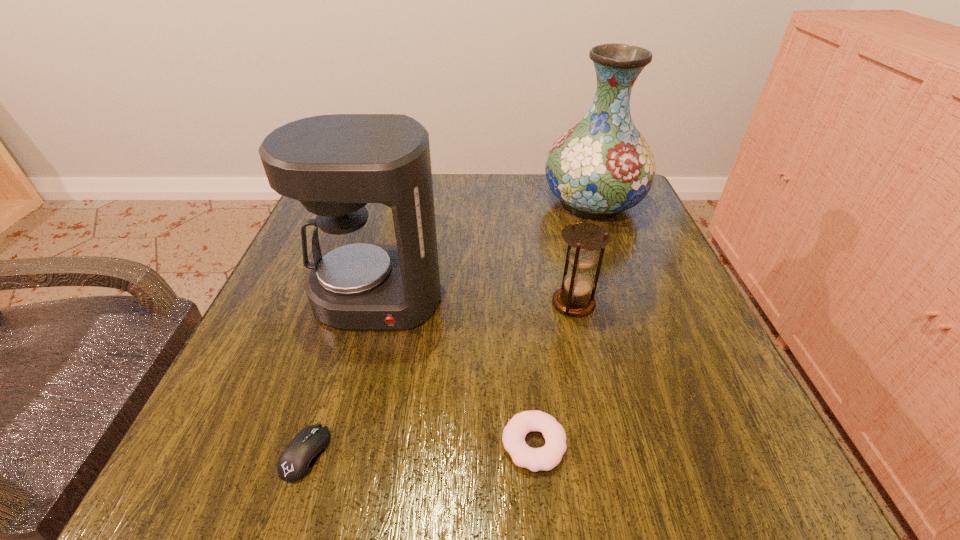
At what (x,y) coordinates should I click in order to perform the action: click on vacant area at the left edge. Please return your answer as a coordinate pair (x, y). Looking at the image, I should click on (262, 370).

Find the location of a particular element. Image resolution: width=960 pixels, height=540 pixels. free space at the right edge of the desktop is located at coordinates (616, 334).

I want to click on free space at the far left corner of the desktop, so tap(377, 216).

In the image, there is a desktop. Identify the location of vacant space at the near left corner. The image size is (960, 540). (252, 472).

Locate an element on the screen. This screenshot has width=960, height=540. empty location between the computer equipment and the farthest object is located at coordinates (449, 329).

The height and width of the screenshot is (540, 960). What are the coordinates of `free space between the doughnut and the third tallest object` in the screenshot? It's located at (554, 374).

Locate an element on the screen. This screenshot has height=540, width=960. empty space between the computer equipment and the farthest object is located at coordinates (449, 329).

This screenshot has width=960, height=540. Find the location of `free space between the farthest object and the coffee maker`. free space between the farthest object and the coffee maker is located at coordinates (485, 251).

This screenshot has height=540, width=960. I want to click on blank region between the farthest object and the computer equipment, so click(449, 329).

Find the location of a particular element. This screenshot has height=540, width=960. free area in between the computer equipment and the coffee maker is located at coordinates (341, 376).